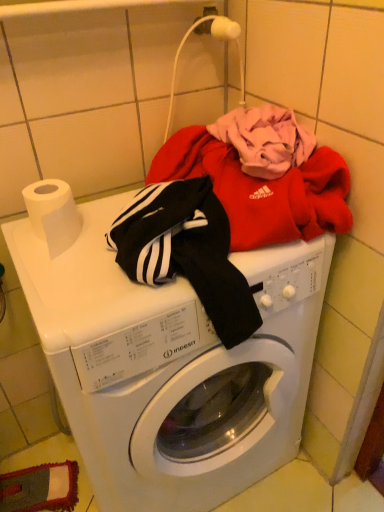
Question: Does white glossy washing machine at center have a lesser height compared to white matte toilet paper at left?

Choices:
 (A) no
 (B) yes

Answer: (A)

Question: Considering the relative sizes of white glossy washing machine at center and white matte toilet paper at left in the image provided, is white glossy washing machine at center smaller than white matte toilet paper at left?

Choices:
 (A) yes
 (B) no

Answer: (B)

Question: Is white matte toilet paper at left surrounded by white glossy washing machine at center?

Choices:
 (A) no
 (B) yes

Answer: (A)

Question: Does white glossy washing machine at center have a lesser width compared to white matte toilet paper at left?

Choices:
 (A) yes
 (B) no

Answer: (B)

Question: Does white glossy washing machine at center appear on the left side of white matte toilet paper at left?

Choices:
 (A) yes
 (B) no

Answer: (B)

Question: Is white glossy washing machine at center outside of white matte toilet paper at left?

Choices:
 (A) no
 (B) yes

Answer: (B)

Question: Does white matte toilet paper at left have a greater height compared to white glossy washing machine at center?

Choices:
 (A) yes
 (B) no

Answer: (B)

Question: Can you confirm if white matte toilet paper at left is wider than white glossy washing machine at center?

Choices:
 (A) yes
 (B) no

Answer: (B)

Question: Is the depth of white matte toilet paper at left greater than that of white glossy washing machine at center?

Choices:
 (A) yes
 (B) no

Answer: (A)

Question: Considering the relative sizes of white matte toilet paper at left and white glossy washing machine at center in the image provided, is white matte toilet paper at left shorter than white glossy washing machine at center?

Choices:
 (A) yes
 (B) no

Answer: (A)

Question: From a real-world perspective, is white matte toilet paper at left beneath white glossy washing machine at center?

Choices:
 (A) no
 (B) yes

Answer: (A)

Question: Could you tell me if white matte toilet paper at left is facing white glossy washing machine at center?

Choices:
 (A) no
 (B) yes

Answer: (A)

Question: Is point click(x=117, y=470) closer or farther from the camera than point click(x=66, y=200)?

Choices:
 (A) farther
 (B) closer

Answer: (A)